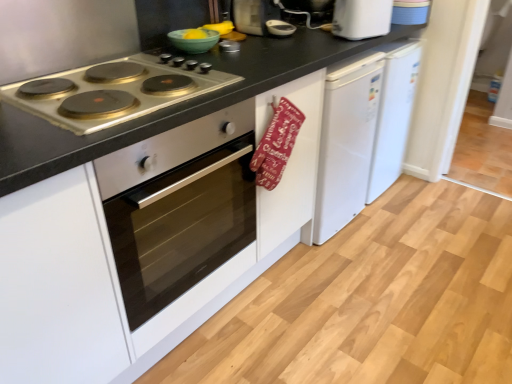
Question: Is white plastic toaster at upper right inside or outside of green matte bowl at upper center?

Choices:
 (A) outside
 (B) inside

Answer: (A)

Question: Looking at their shapes, would you say white plastic toaster at upper right is wider or thinner than green matte bowl at upper center?

Choices:
 (A) wide
 (B) thin

Answer: (B)

Question: Which object is positioned farthest from the satin silver oven at left?

Choices:
 (A) red fabric oven mitt at center
 (B) white plastic toaster at upper right
 (C) green matte bowl at upper center
 (D) metallic silver cooktop at left

Answer: (B)

Question: Considering the real-world distances, which object is farthest from the satin silver oven at left?

Choices:
 (A) red fabric oven mitt at center
 (B) metallic silver cooktop at left
 (C) white plastic toaster at upper right
 (D) green matte bowl at upper center

Answer: (C)